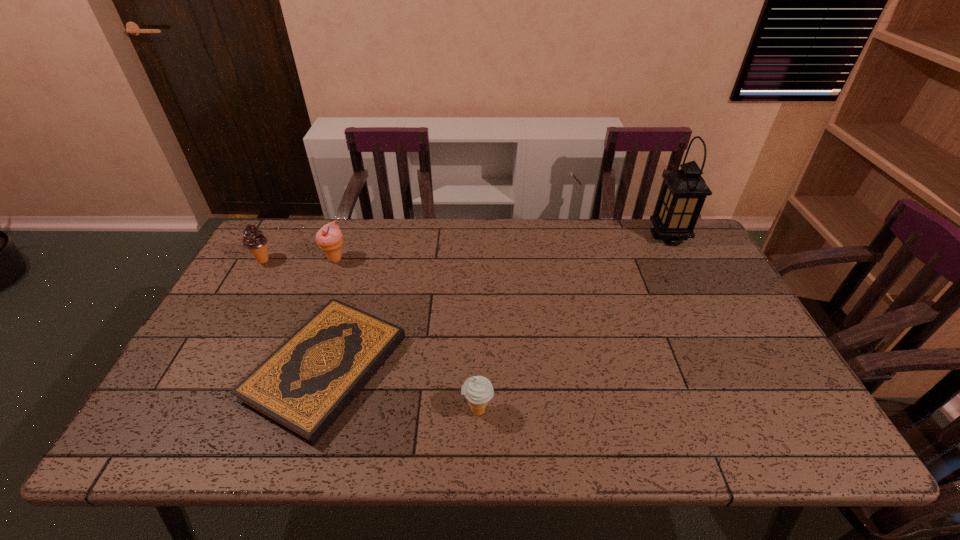
At what (x,y) coordinates should I click in order to perform the action: click on lantern. Please return your answer as a coordinate pair (x, y). Looking at the image, I should click on (684, 191).

This screenshot has height=540, width=960. Find the location of `the farthest object`. the farthest object is located at coordinates (684, 191).

Locate an element on the screen. The image size is (960, 540). the second icecream from left to right is located at coordinates (329, 238).

This screenshot has width=960, height=540. I want to click on the leftmost object, so click(254, 240).

Where is `the fourth tallest object`? The height and width of the screenshot is (540, 960). the fourth tallest object is located at coordinates (478, 390).

Where is `the nearest icecream`? The height and width of the screenshot is (540, 960). the nearest icecream is located at coordinates (x=478, y=390).

Identify the location of hardback book. This screenshot has width=960, height=540. (303, 386).

This screenshot has width=960, height=540. In order to click on free space located 0.200m on the front of the lantern in this screenshot , I will do `click(696, 290)`.

At what (x,y) coordinates should I click in order to perform the action: click on free spot located 0.110m on the right of the second icecream from right to left. Please return your answer as a coordinate pair (x, y). The height and width of the screenshot is (540, 960). Looking at the image, I should click on (383, 260).

At what (x,y) coordinates should I click in order to perform the action: click on vacant space located 0.330m on the front of the leftmost object. Please return your answer as a coordinate pair (x, y). Looking at the image, I should click on (211, 351).